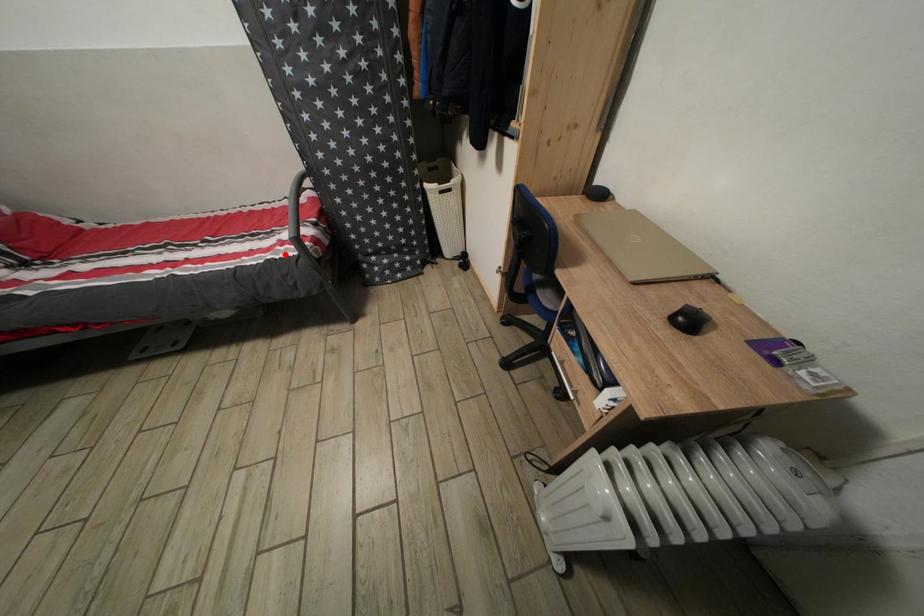
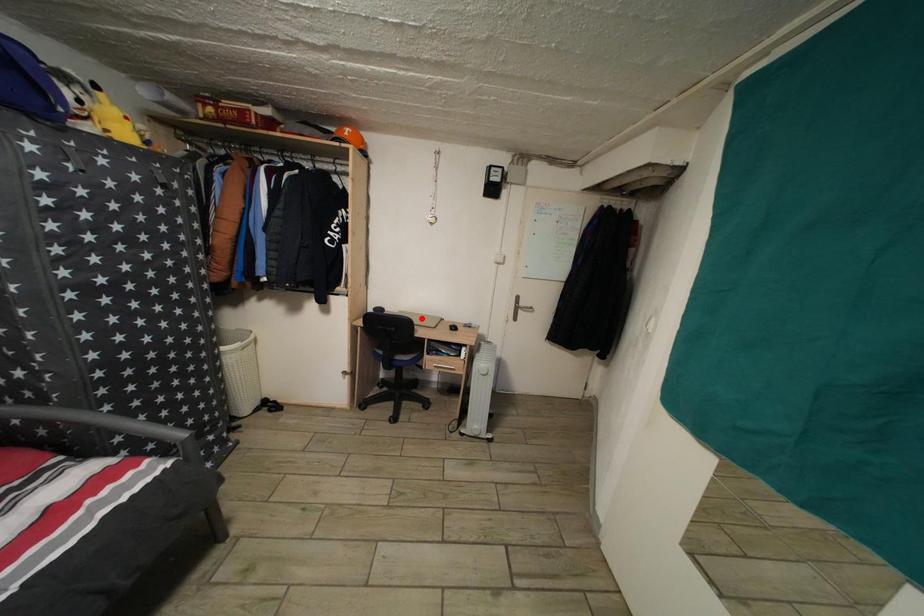
I am providing you with two images of the same scene from different viewpoints. A red point is marked on the first image and another point is marked on the second image. Do the highlighted points in image1 and image2 indicate the same real-world spot?

No